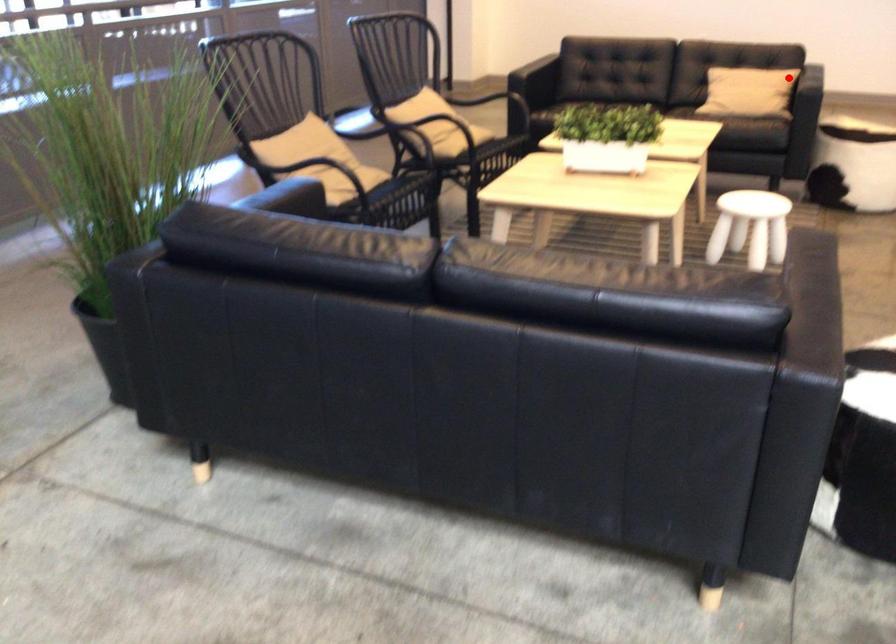
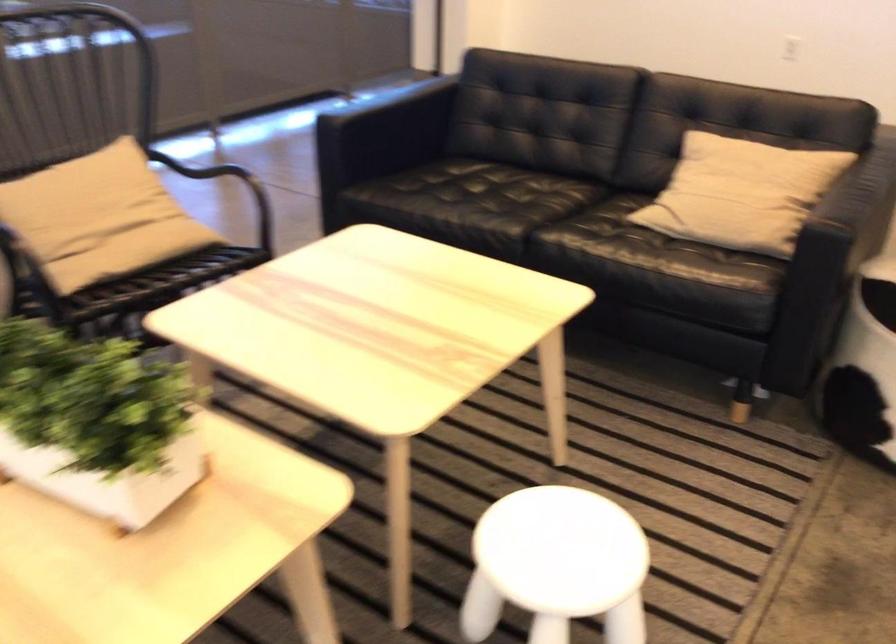
Question: I am providing you with two images of the same scene from different viewpoints. A red point is shown in image1. For the corresponding object point in image2, is it positioned nearer or farther from the camera?

Choices:
 (A) Nearer
 (B) Farther

Answer: (A)